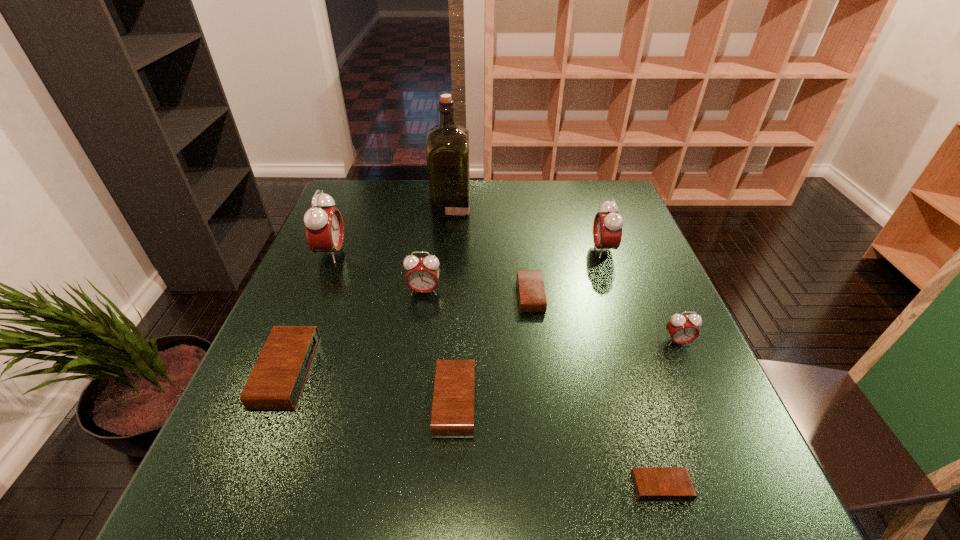
This screenshot has height=540, width=960. What are the coordinates of `the tallest object` in the screenshot? It's located at (447, 146).

You are a GUI agent. You are given a task and a screenshot of the screen. Output one action in this format:
    pyautogui.click(x=<x>, y=<y>)
    Task: Click on the liquor
    
    Given the screenshot: What is the action you would take?
    pyautogui.click(x=447, y=146)

Locate an element on the screen. The height and width of the screenshot is (540, 960). the leftmost pink alarm clock is located at coordinates (324, 226).

In order to click on the eighth shortest object in this screenshot , I will do `click(324, 226)`.

The width and height of the screenshot is (960, 540). Find the location of `the third smallest pink alarm clock`. the third smallest pink alarm clock is located at coordinates (607, 228).

Identify the location of the second pink alarm clock from right to left. This screenshot has height=540, width=960. (607, 228).

The width and height of the screenshot is (960, 540). I want to click on the third farthest pink alarm clock, so click(x=422, y=276).

Locate an element on the screen. The height and width of the screenshot is (540, 960). the sixth shortest alarm clock is located at coordinates (422, 276).

Identify the location of the fifth tallest object. (682, 329).

Locate an element on the screen. Image resolution: width=960 pixels, height=540 pixels. the fifth shortest alarm clock is located at coordinates (682, 329).